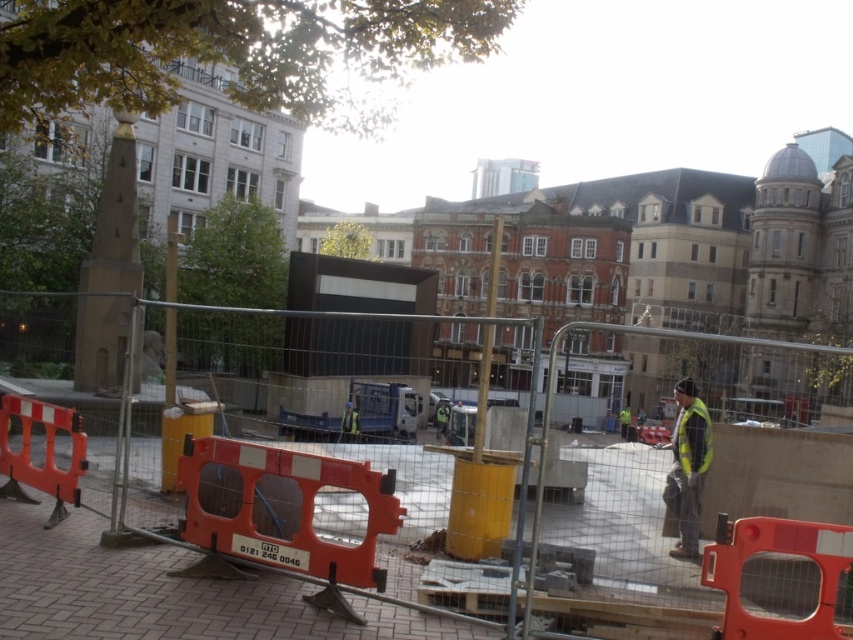
Who is more forward, [805,374] or [682,460]?

Positioned in front is point [682,460].

Is orange plastic barrier at center taller than yellow reflective safety vest at right?

Yes, orange plastic barrier at center is taller than yellow reflective safety vest at right.

Which is behind, point (379, 362) or point (680, 429)?

The point (379, 362) is more distant.

Find the location of `orange plastic barrier at center`. orange plastic barrier at center is located at coordinates (390, 472).

Which is more to the right, reflective yellow vest at center or yellow reflective safety vest at right?

yellow reflective safety vest at right

Between reflective yellow vest at center and yellow reflective safety vest at right, which one appears on the left side from the viewer's perspective?

Positioned to the left is reflective yellow vest at center.

Does point (706, 456) lie in front of point (709, 435)?

Yes, it is.

Image resolution: width=853 pixels, height=640 pixels. What are the coordinates of `reflective yellow vest at center` in the screenshot? It's located at (688, 467).

Is point (592, 528) more distant than point (692, 388)?

No, it is not.

Is the position of orange plastic barrier at center less distant than that of reflective yellow vest at center?

Yes, orange plastic barrier at center is in front of reflective yellow vest at center.

Is point (828, 616) more distant than point (706, 429)?

No, it is not.

Where is `orange plastic barrier at center`? orange plastic barrier at center is located at coordinates (390, 472).